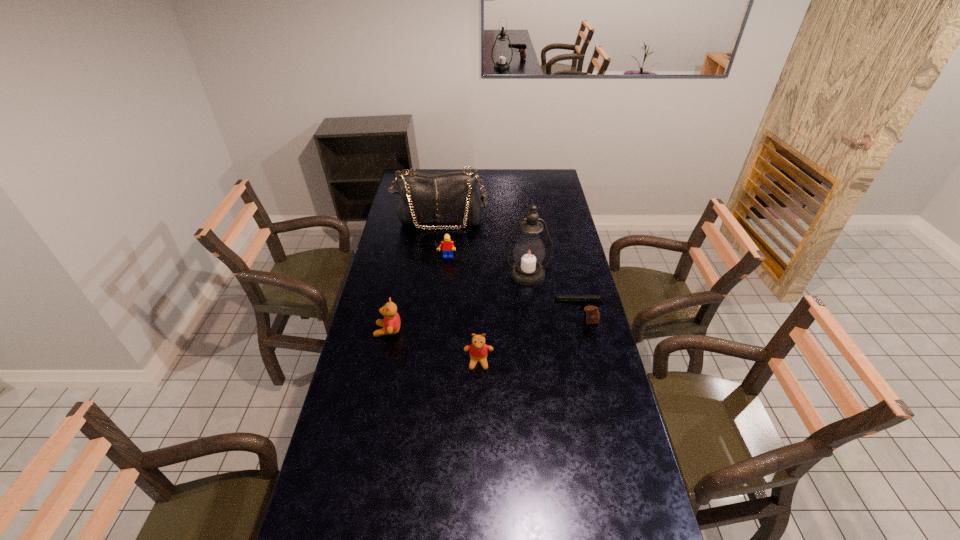
The teddy bears are evenly distributed in the image. To maintain this, where would you place another teddy bear on the right? Please point to a free space. Please provide its 2D coordinates. Your answer should be formatted as a tuple, i.e. [(x, y)], where the tuple contains the x and y coordinates of a point satisfying the conditions above.

[(583, 397)]